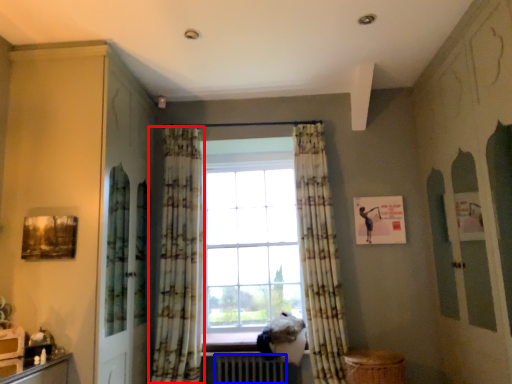
Question: Which of the following is the closest to the observer, curtain (highlighted by a red box) or radiator (highlighted by a blue box)?

Choices:
 (A) curtain
 (B) radiator

Answer: (A)